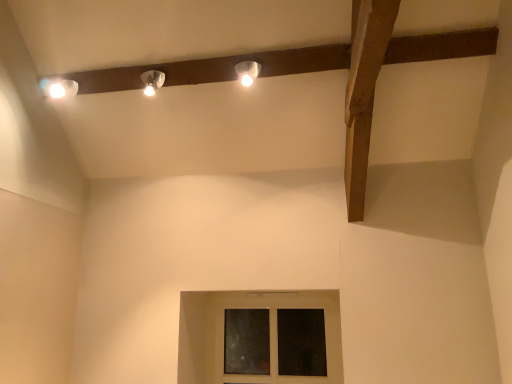
Question: Can you confirm if transparent glass window at center is smaller than matte white lamp at upper center, the 1th lamp in the right-to-left sequence?

Choices:
 (A) yes
 (B) no

Answer: (B)

Question: Is transparent glass window at center far from matte white lamp at upper center, the 1th lamp in the right-to-left sequence?

Choices:
 (A) no
 (B) yes

Answer: (B)

Question: Does transparent glass window at center have a greater height compared to matte white lamp at upper center, the 1th lamp in the right-to-left sequence?

Choices:
 (A) yes
 (B) no

Answer: (A)

Question: Can you confirm if transparent glass window at center is bigger than matte white lamp at upper center, which is counted as the second lamp, starting from the left?

Choices:
 (A) no
 (B) yes

Answer: (B)

Question: Is transparent glass window at center wider than matte white lamp at upper center, which is counted as the second lamp, starting from the left?

Choices:
 (A) yes
 (B) no

Answer: (B)

Question: Would you say matte white lamp at upper center, which is the first lamp in left-to-right order, is to the left or to the right of matte white lamp at upper center, the 1th lamp in the right-to-left sequence, in the picture?

Choices:
 (A) right
 (B) left

Answer: (B)

Question: Is matte white lamp at upper center, which is the first lamp in left-to-right order, situated inside matte white lamp at upper center, the 1th lamp in the right-to-left sequence, or outside?

Choices:
 (A) inside
 (B) outside

Answer: (B)

Question: Looking at their shapes, would you say matte white lamp at upper center, which is the first lamp in left-to-right order, is wider or thinner than matte white lamp at upper center, the 1th lamp in the right-to-left sequence?

Choices:
 (A) thin
 (B) wide

Answer: (B)

Question: In terms of size, does matte white lamp at upper center, which is the first lamp in left-to-right order, appear bigger or smaller than matte white lamp at upper center, the 1th lamp in the right-to-left sequence?

Choices:
 (A) big
 (B) small

Answer: (A)

Question: Is matte white lamp at upper center, which is the first lamp in left-to-right order, spatially inside transparent glass window at center, or outside of it?

Choices:
 (A) outside
 (B) inside

Answer: (A)

Question: In the image, is matte white lamp at upper center, which is the first lamp in left-to-right order, positioned in front of or behind transparent glass window at center?

Choices:
 (A) front
 (B) behind

Answer: (A)

Question: Does point (146, 79) appear closer or farther from the camera than point (226, 377)?

Choices:
 (A) farther
 (B) closer

Answer: (B)

Question: Based on their positions, is matte white lamp at upper center, which is the first lamp in left-to-right order, located to the left or right of transparent glass window at center?

Choices:
 (A) right
 (B) left

Answer: (B)

Question: Would you say transparent glass window at center is to the left or to the right of matte white lamp at upper center, the 1th lamp in the right-to-left sequence, in the picture?

Choices:
 (A) left
 (B) right

Answer: (B)

Question: From a real-world perspective, relative to matte white lamp at upper center, which is counted as the second lamp, starting from the left, is transparent glass window at center vertically above or below?

Choices:
 (A) above
 (B) below

Answer: (B)